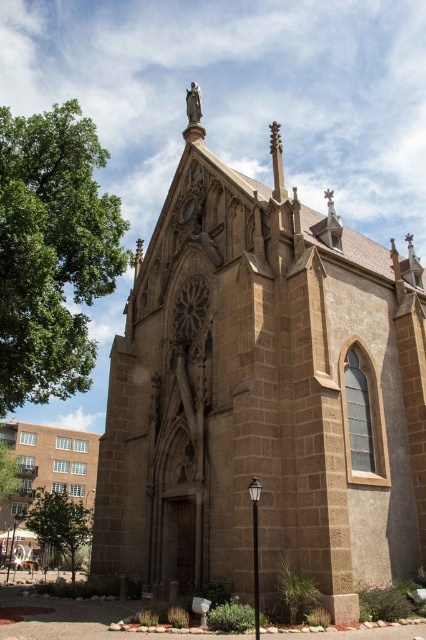
Question: Based on their relative distances, which object is farther from the brown stone church at lower left?

Choices:
 (A) brown stone church at center
 (B) green leafy tree at upper left
 (C) green leafy tree at lower left

Answer: (A)

Question: Does brown stone church at center have a greater width compared to green leafy tree at lower left?

Choices:
 (A) no
 (B) yes

Answer: (B)

Question: Based on their relative distances, which object is farther from the green leafy tree at lower left?

Choices:
 (A) green leafy tree at upper left
 (B) brown stone church at lower left
 (C) brown stone church at center

Answer: (C)

Question: Can you confirm if brown stone church at center is wider than green leafy tree at lower left?

Choices:
 (A) no
 (B) yes

Answer: (B)

Question: Is brown stone church at lower left above green leafy tree at lower left?

Choices:
 (A) yes
 (B) no

Answer: (B)

Question: Which point appears farthest from the camera in this image?

Choices:
 (A) (224, 454)
 (B) (5, 502)
 (C) (74, 540)

Answer: (B)